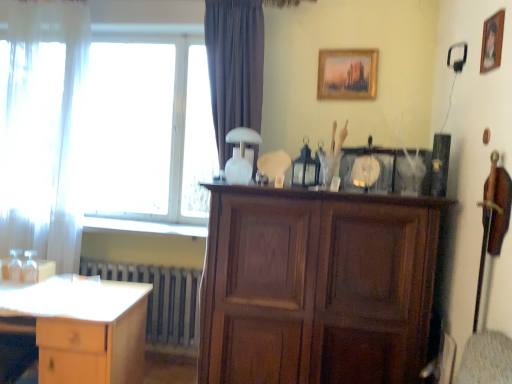
Question: Is white sheer curtain at left positioned in front of metallic gray radiator at lower left?

Choices:
 (A) no
 (B) yes

Answer: (B)

Question: From the image's perspective, is white sheer curtain at left on top of metallic gray radiator at lower left?

Choices:
 (A) no
 (B) yes

Answer: (B)

Question: Is white sheer curtain at left touching metallic gray radiator at lower left?

Choices:
 (A) no
 (B) yes

Answer: (A)

Question: Is metallic gray radiator at lower left surrounded by white sheer curtain at left?

Choices:
 (A) no
 (B) yes

Answer: (A)

Question: Is white sheer curtain at left thinner than metallic gray radiator at lower left?

Choices:
 (A) no
 (B) yes

Answer: (A)

Question: From a real-world perspective, is white sheer curtain at left below metallic gray radiator at lower left?

Choices:
 (A) yes
 (B) no

Answer: (B)

Question: Is wooden picture frame at upper right, the second picture frame viewed from the left, positioned before white sheer curtain at left?

Choices:
 (A) no
 (B) yes

Answer: (B)

Question: Does wooden picture frame at upper right, the first picture frame from the right, turn towards white sheer curtain at left?

Choices:
 (A) yes
 (B) no

Answer: (A)

Question: From the image's perspective, is wooden picture frame at upper right, the first picture frame from the right, located beneath white sheer curtain at left?

Choices:
 (A) no
 (B) yes

Answer: (A)

Question: Is wooden picture frame at upper right, the second picture frame viewed from the left, turned away from white sheer curtain at left?

Choices:
 (A) yes
 (B) no

Answer: (B)

Question: Is wooden picture frame at upper right, the first picture frame from the right, wider than white sheer curtain at left?

Choices:
 (A) yes
 (B) no

Answer: (B)

Question: Is wooden picture frame at upper right, placed as the 2th picture frame when sorted from back to front, to the right of white sheer curtain at left from the viewer's perspective?

Choices:
 (A) yes
 (B) no

Answer: (A)

Question: Does white sheer curtain at left have a lesser height compared to transparent glass window at upper left?

Choices:
 (A) yes
 (B) no

Answer: (B)